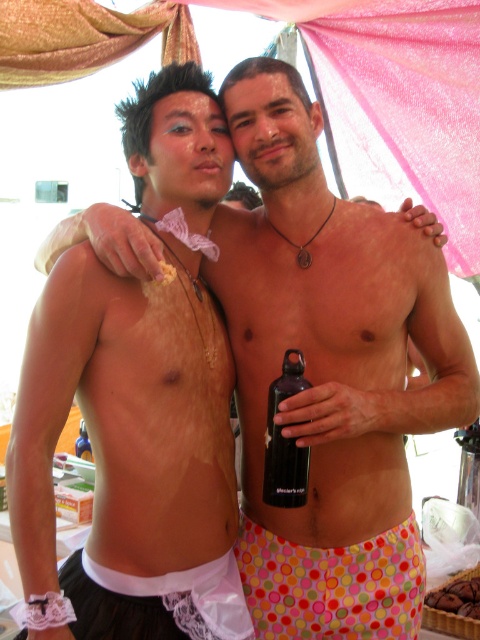
Question: Does polka dot fabric shorts at lower center appear under white lace garter at lower left?

Choices:
 (A) no
 (B) yes

Answer: (A)

Question: Which point is farther to the camera?

Choices:
 (A) white lace garter at lower left
 (B) polka dot fabric shorts at lower center

Answer: (B)

Question: Which of the following is the farthest from the observer?

Choices:
 (A) (215, 637)
 (B) (309, 451)

Answer: (A)

Question: Based on their relative distances, which object is nearer to the polka dot fabric shorts at lower center?

Choices:
 (A) white lace garter at lower left
 (B) black matte water bottle at center

Answer: (A)

Question: Does polka dot fabric shorts at lower center have a smaller size compared to white lace garter at lower left?

Choices:
 (A) no
 (B) yes

Answer: (B)

Question: Does white lace garter at lower left appear over black matte water bottle at center?

Choices:
 (A) no
 (B) yes

Answer: (A)